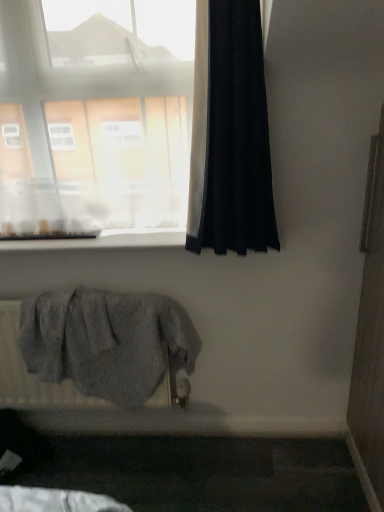
Question: Is black fabric curtain at right not inside transparent glass window at upper left?

Choices:
 (A) no
 (B) yes

Answer: (B)

Question: Is black fabric curtain at right far away from transparent glass window at upper left?

Choices:
 (A) no
 (B) yes

Answer: (A)

Question: Is transparent glass window at upper left inside black fabric curtain at right?

Choices:
 (A) yes
 (B) no

Answer: (B)

Question: Is black fabric curtain at right oriented towards transparent glass window at upper left?

Choices:
 (A) no
 (B) yes

Answer: (A)

Question: Is black fabric curtain at right positioned behind transparent glass window at upper left?

Choices:
 (A) no
 (B) yes

Answer: (A)

Question: Relative to white smooth window sill at upper center, is black fabric curtain at right in front or behind?

Choices:
 (A) front
 (B) behind

Answer: (A)

Question: Looking at the image, does black fabric curtain at right seem bigger or smaller compared to white smooth window sill at upper center?

Choices:
 (A) small
 (B) big

Answer: (B)

Question: Based on their positions, is black fabric curtain at right located to the left or right of white smooth window sill at upper center?

Choices:
 (A) left
 (B) right

Answer: (B)

Question: Is black fabric curtain at right situated inside white smooth window sill at upper center or outside?

Choices:
 (A) outside
 (B) inside

Answer: (A)

Question: From the image's perspective, is gray fabric radiator at lower left above or below white smooth window sill at upper center?

Choices:
 (A) below
 (B) above

Answer: (A)

Question: Is gray fabric radiator at lower left bigger or smaller than white smooth window sill at upper center?

Choices:
 (A) big
 (B) small

Answer: (A)

Question: From a real-world perspective, is gray fabric radiator at lower left physically located above or below white smooth window sill at upper center?

Choices:
 (A) below
 (B) above

Answer: (A)

Question: Is gray fabric radiator at lower left inside the boundaries of white smooth window sill at upper center, or outside?

Choices:
 (A) inside
 (B) outside

Answer: (B)

Question: From the image's perspective, is transparent glass window at upper left above or below black fabric curtain at right?

Choices:
 (A) below
 (B) above

Answer: (B)

Question: Considering the positions of transparent glass window at upper left and black fabric curtain at right in the image, is transparent glass window at upper left taller or shorter than black fabric curtain at right?

Choices:
 (A) tall
 (B) short

Answer: (A)